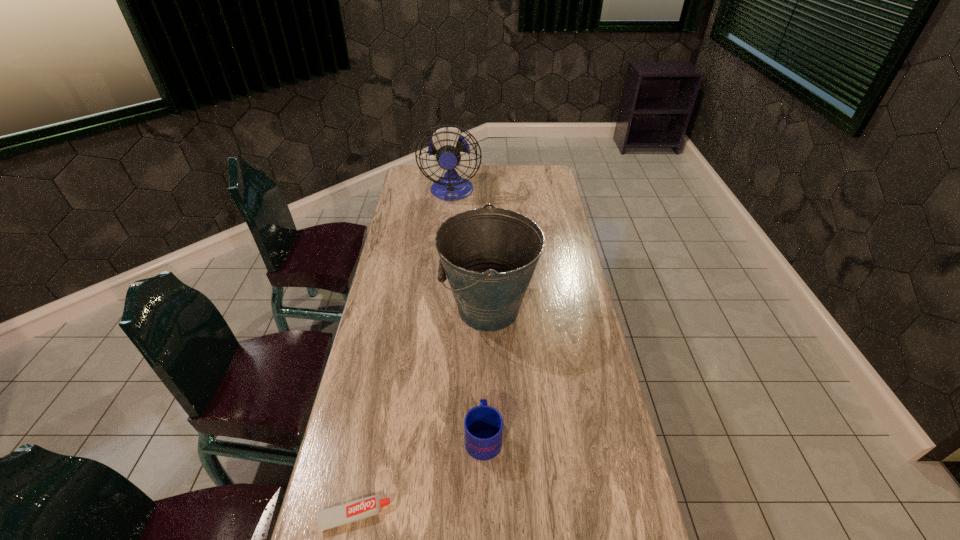
Where is `the farthest object`? Image resolution: width=960 pixels, height=540 pixels. the farthest object is located at coordinates (449, 154).

The image size is (960, 540). What are the coordinates of `the second farthest object` in the screenshot? It's located at (489, 255).

Identify the location of the third tallest object. (483, 425).

Locate an element on the screen. The width and height of the screenshot is (960, 540). the third farthest object is located at coordinates (483, 425).

This screenshot has width=960, height=540. What are the coordinates of `the shortest object` in the screenshot? It's located at (356, 510).

Identify the location of the nearest object. This screenshot has height=540, width=960. (356, 510).

Find the location of `free region located 0.320m in front of the fan where the airflow is directed`. free region located 0.320m in front of the fan where the airflow is directed is located at coordinates (446, 253).

Identify the location of vacant space situated with the handle on opposite sides of the third nearest object. (423, 309).

At what (x,y) coordinates should I click in order to perform the action: click on free space located with the handle on opposite sides of the third nearest object. Please return your answer as a coordinate pair (x, y). Looking at the image, I should click on (415, 309).

You are a GUI agent. You are given a task and a screenshot of the screen. Output one action in this format:
    pyautogui.click(x=<x>, y=<y>)
    Task: Click on the vacant space located 0.190m with the handle on opposite sides of the third nearest object
    This screenshot has width=960, height=540.
    Given the screenshot: What is the action you would take?
    pyautogui.click(x=385, y=309)